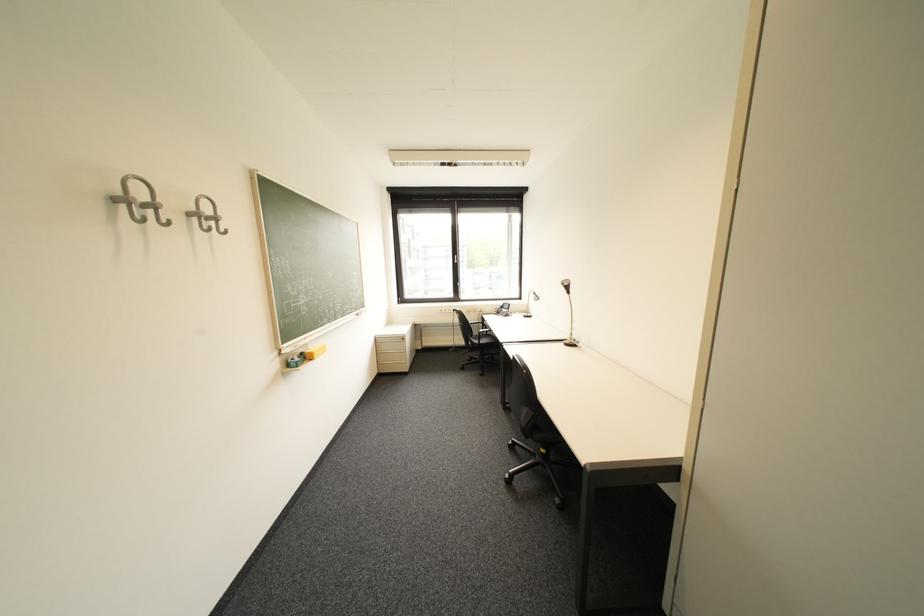
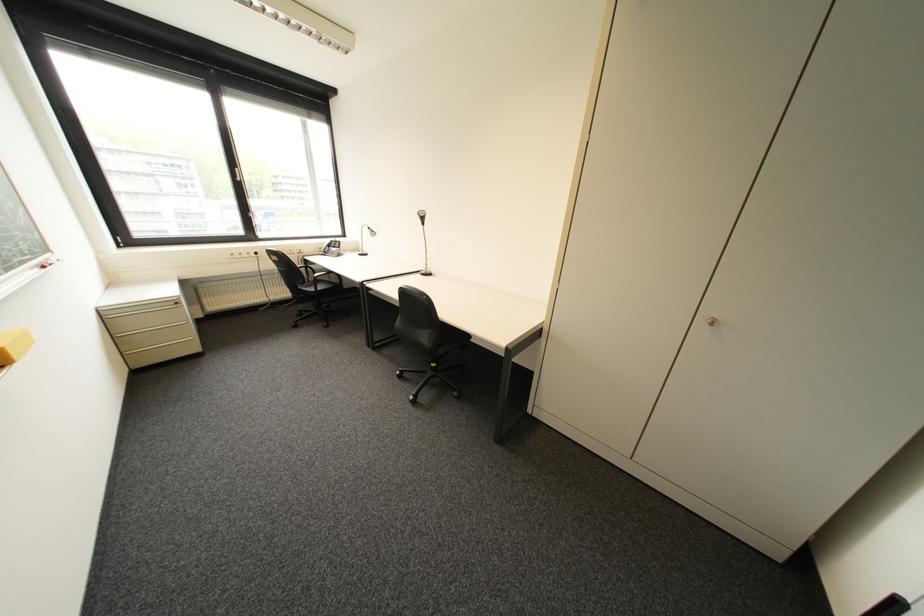
The point at (480, 360) is marked in the first image. Where is the corresponding point in the second image?

(309, 314)